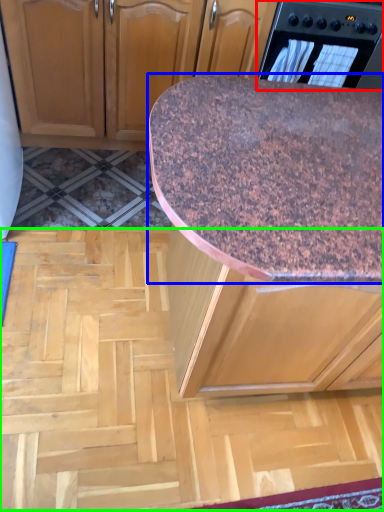
Question: Which is nearer to the home appliance (highlighted by a red box)? countertop (highlighted by a blue box) or plywood (highlighted by a green box).

Choices:
 (A) countertop
 (B) plywood

Answer: (A)